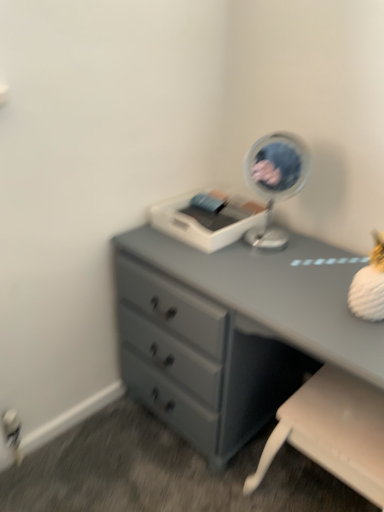
The height and width of the screenshot is (512, 384). In order to click on free location above white plastic swivel chair at lower right (from a real-world perspective) in this screenshot , I will do (x=343, y=414).